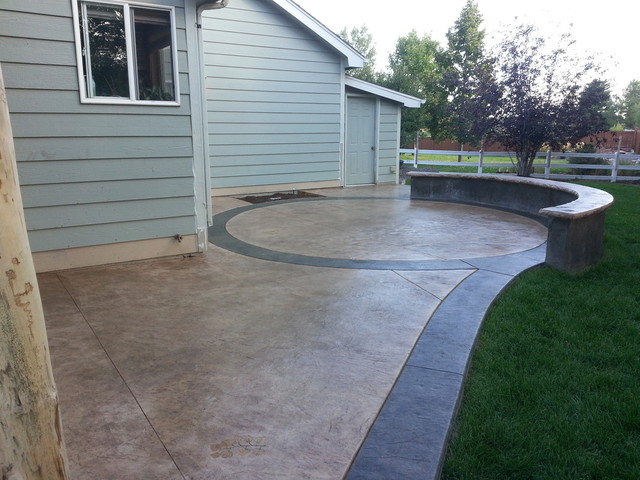
Where is `areas with a black tile floor`? This screenshot has height=480, width=640. areas with a black tile floor is located at coordinates 426,397, 509,259, 234,240, 531,213, 330,198.